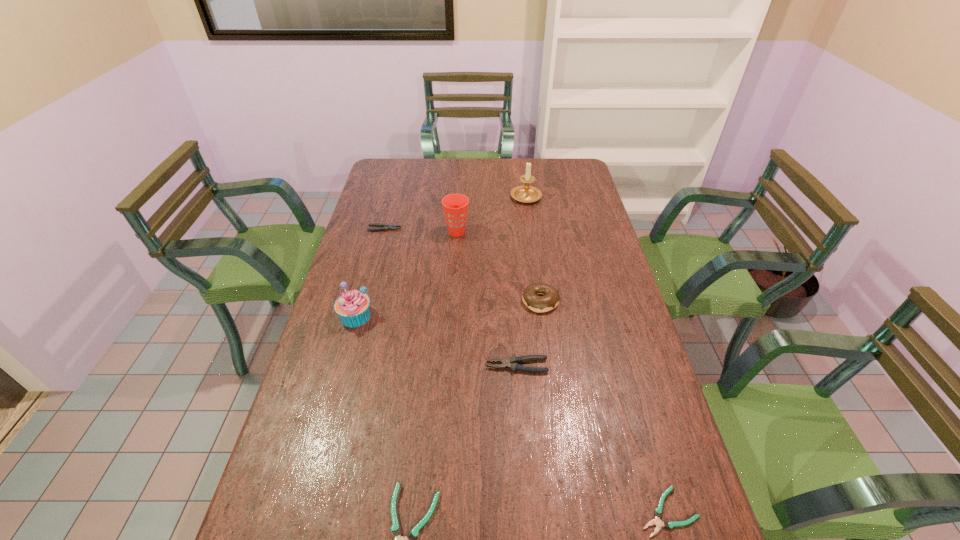
Find the location of a particular element. the third shortest object is located at coordinates (385, 227).

The height and width of the screenshot is (540, 960). What are the coordinates of `the smaller teal pliers` in the screenshot? It's located at (668, 524).

Locate an element on the screen. The height and width of the screenshot is (540, 960). the shortest object is located at coordinates (668, 524).

I want to click on vacant area situated with a handle on the side of the farthest object, so click(x=521, y=166).

Where is `vacant space located with a handle on the side of the farthest object`? This screenshot has width=960, height=540. vacant space located with a handle on the side of the farthest object is located at coordinates (523, 175).

Locate an element on the screen. vacant area located 0.210m with a handle on the side of the farthest object is located at coordinates (521, 162).

Locate an element on the screen. This screenshot has width=960, height=540. vacant region located on the back of the seventh shortest object is located at coordinates (460, 182).

Identify the location of vacant space located 0.150m on the right of the muffin. (421, 316).

Where is `vacant region located 0.160m on the front of the brown doughnut`? vacant region located 0.160m on the front of the brown doughnut is located at coordinates (548, 357).

Where is `vacant space positioned at the gripping part of the right gray pliers`? vacant space positioned at the gripping part of the right gray pliers is located at coordinates (389, 366).